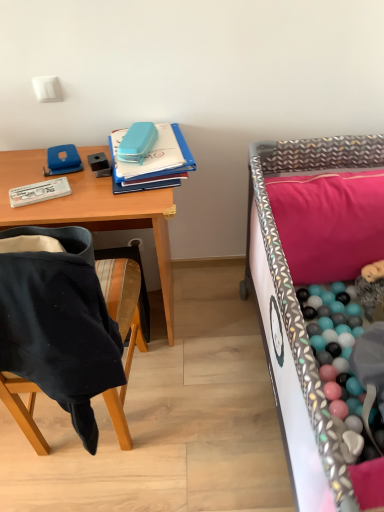
Question: Does pink fabric pillow at upper right have a lesser height compared to patterned fabric infant bed at right?

Choices:
 (A) no
 (B) yes

Answer: (B)

Question: Could you tell me if pink fabric pillow at upper right is turned towards patterned fabric infant bed at right?

Choices:
 (A) no
 (B) yes

Answer: (B)

Question: Is pink fabric pillow at upper right behind patterned fabric infant bed at right?

Choices:
 (A) yes
 (B) no

Answer: (A)

Question: Would you consider pink fabric pillow at upper right to be distant from patterned fabric infant bed at right?

Choices:
 (A) no
 (B) yes

Answer: (A)

Question: Is pink fabric pillow at upper right taller than patterned fabric infant bed at right?

Choices:
 (A) no
 (B) yes

Answer: (A)

Question: From the image's perspective, is black fabric chair at left located above or below blue plastic notebook at upper center?

Choices:
 (A) below
 (B) above

Answer: (A)

Question: Considering the positions of black fabric chair at left and blue plastic notebook at upper center in the image, is black fabric chair at left wider or thinner than blue plastic notebook at upper center?

Choices:
 (A) wide
 (B) thin

Answer: (B)

Question: Does point (11, 375) appear closer or farther from the camera than point (190, 157)?

Choices:
 (A) farther
 (B) closer

Answer: (B)

Question: Is black fabric chair at left spatially inside blue plastic notebook at upper center, or outside of it?

Choices:
 (A) outside
 (B) inside

Answer: (A)

Question: Considering the relative positions of pink fabric pillow at upper right and patterned fabric infant bed at right in the image provided, is pink fabric pillow at upper right to the left or to the right of patterned fabric infant bed at right?

Choices:
 (A) left
 (B) right

Answer: (A)

Question: Is pink fabric pillow at upper right inside or outside of patterned fabric infant bed at right?

Choices:
 (A) inside
 (B) outside

Answer: (A)

Question: Is point (296, 207) positioned closer to the camera than point (329, 462)?

Choices:
 (A) closer
 (B) farther

Answer: (B)

Question: From a real-world perspective, is pink fabric pillow at upper right physically located above or below patterned fabric infant bed at right?

Choices:
 (A) above
 (B) below

Answer: (A)

Question: Relative to wooden desk at upper left, is blue plastic notebook at upper center in front or behind?

Choices:
 (A) front
 (B) behind

Answer: (B)

Question: From the image's perspective, is blue plastic notebook at upper center located above or below wooden desk at upper left?

Choices:
 (A) above
 (B) below

Answer: (A)